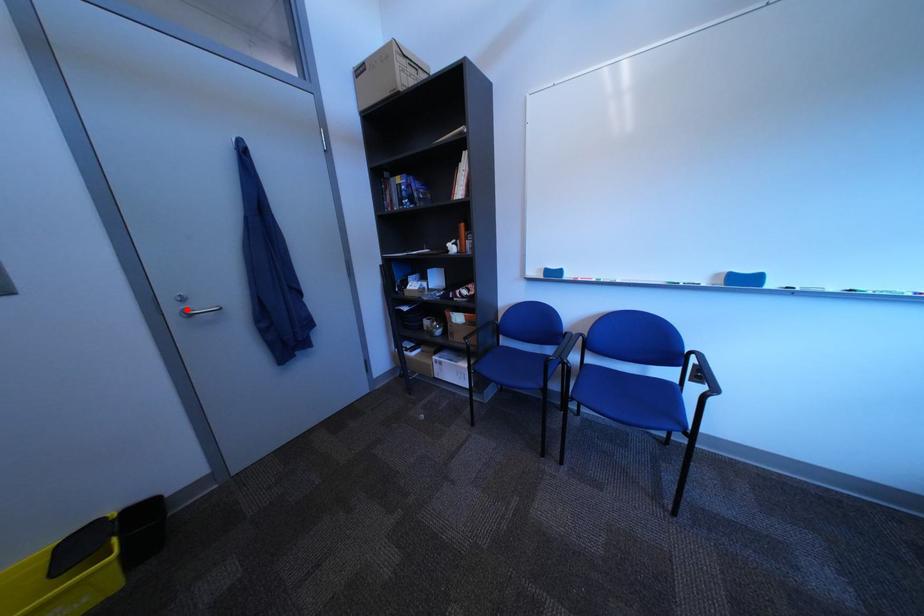
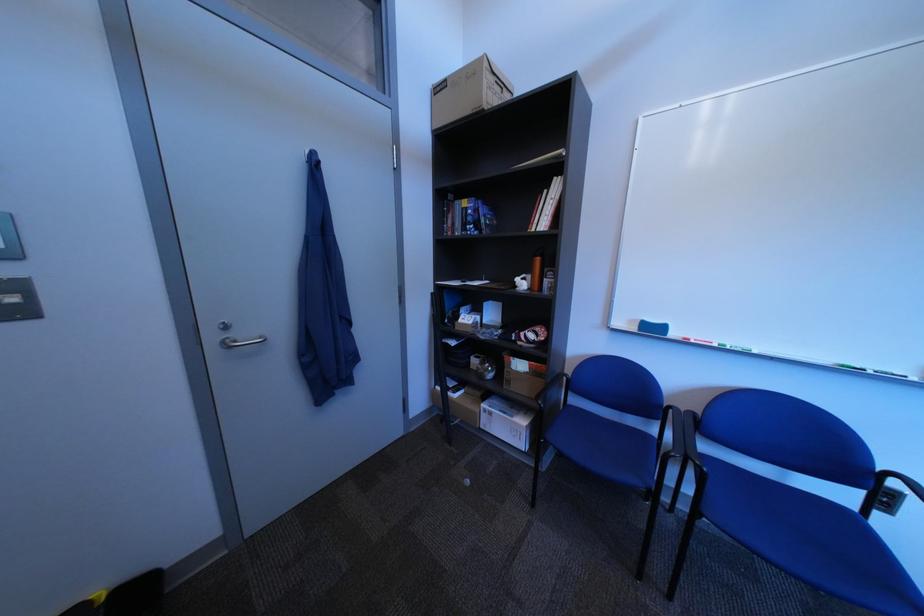
In the second image, find the point that corresponds to the highlighted location in the first image.

(226, 339)